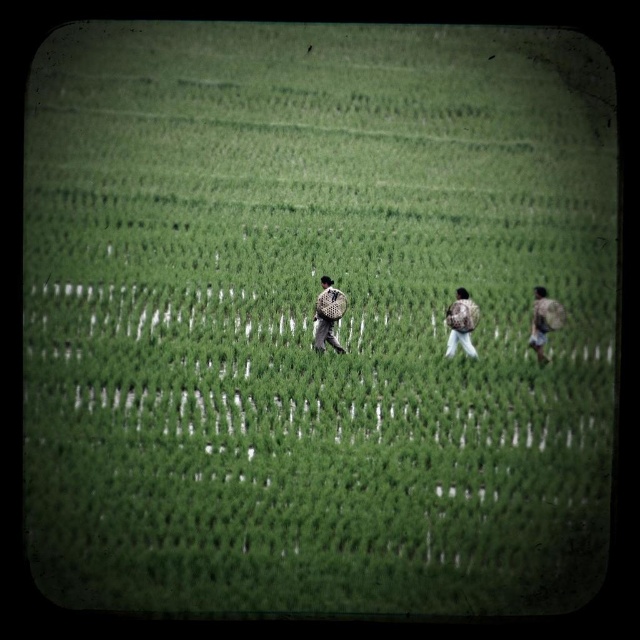
Question: Estimate the real-world distances between objects in this image. Which object is farther from the camouflage backpack at center?

Choices:
 (A) camouflage fabric backpack at right
 (B) camouflage-patterned backpack at center

Answer: (B)

Question: Is camouflage-patterned backpack at center behind camouflage backpack at center?

Choices:
 (A) yes
 (B) no

Answer: (A)

Question: Can you confirm if camouflage fabric backpack at right is positioned above camouflage backpack at center?

Choices:
 (A) no
 (B) yes

Answer: (A)

Question: Which is farther from the camouflage-patterned backpack at center?

Choices:
 (A) camouflage fabric backpack at right
 (B) camouflage backpack at center

Answer: (A)

Question: Which point appears farthest from the camera in this image?

Choices:
 (A) (330, 321)
 (B) (550, 301)

Answer: (B)

Question: Does camouflage-patterned backpack at center have a smaller size compared to camouflage backpack at center?

Choices:
 (A) yes
 (B) no

Answer: (B)